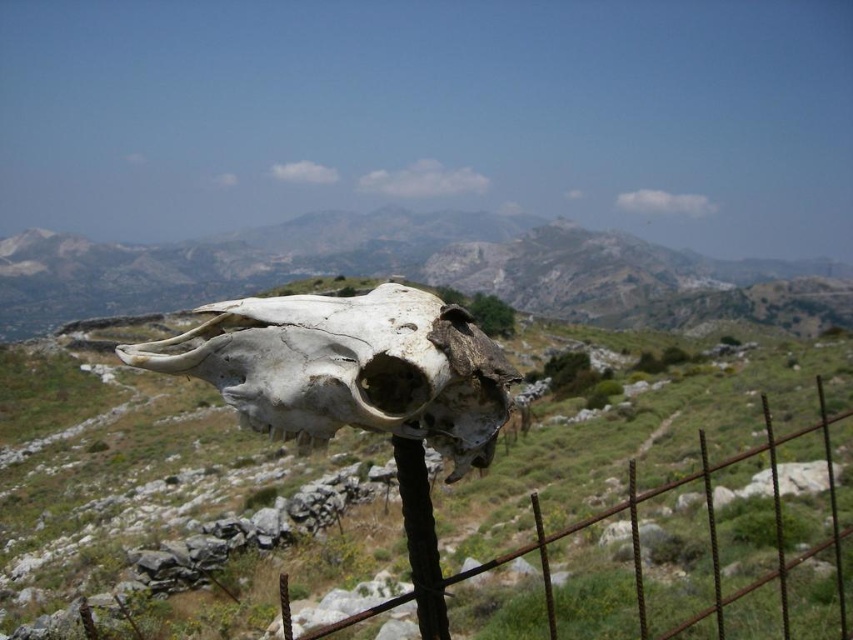
Does white weathered skull at center have a greater width compared to rusty metal fence at center?

Incorrect, white weathered skull at center's width does not surpass rusty metal fence at center's.

This screenshot has height=640, width=853. What do you see at coordinates (349, 369) in the screenshot?
I see `white weathered skull at center` at bounding box center [349, 369].

The image size is (853, 640). What do you see at coordinates (349, 369) in the screenshot?
I see `white weathered skull at center` at bounding box center [349, 369].

Locate an element on the screen. This screenshot has width=853, height=640. white weathered skull at center is located at coordinates (349, 369).

Does gray rocky mountain at center have a greater width compared to white weathered skull at center?

Indeed, gray rocky mountain at center has a greater width compared to white weathered skull at center.

The height and width of the screenshot is (640, 853). In order to click on gray rocky mountain at center in this screenshot , I will do `click(367, 266)`.

What are the coordinates of `gray rocky mountain at center` in the screenshot? It's located at (367, 266).

Does gray rocky mountain at center appear under rusty metal fence at center?

No.

The height and width of the screenshot is (640, 853). I want to click on gray rocky mountain at center, so click(367, 266).